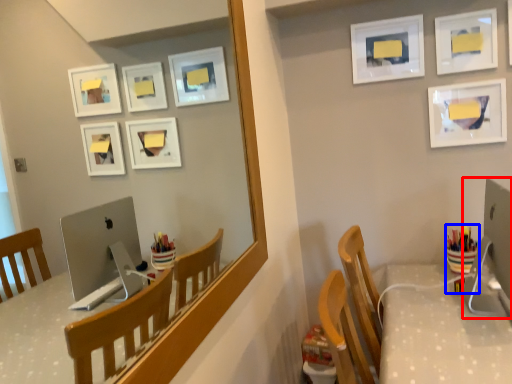
Question: Which point is further to the camera, desktop computer (highlighted by a red box) or stationery (highlighted by a blue box)?

Choices:
 (A) desktop computer
 (B) stationery

Answer: (B)